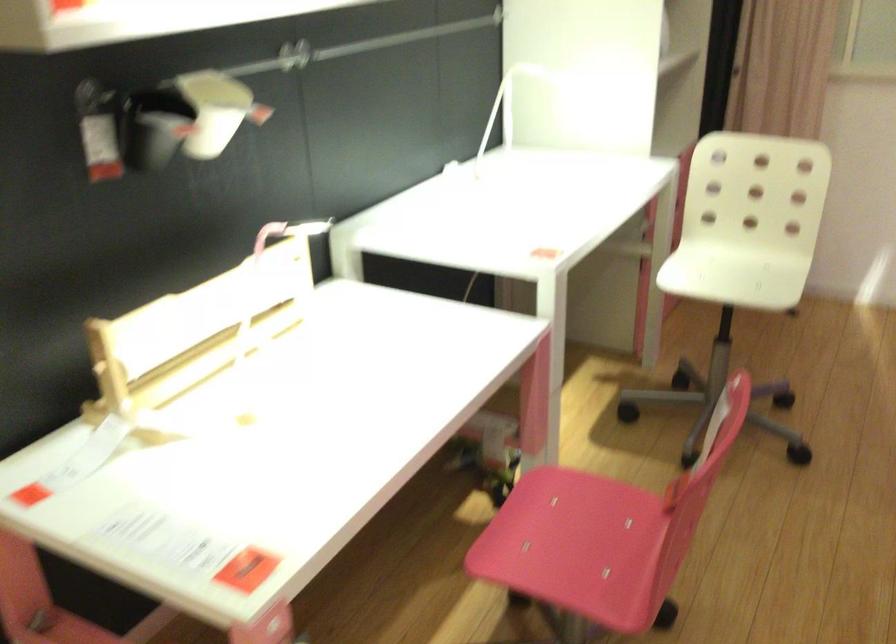
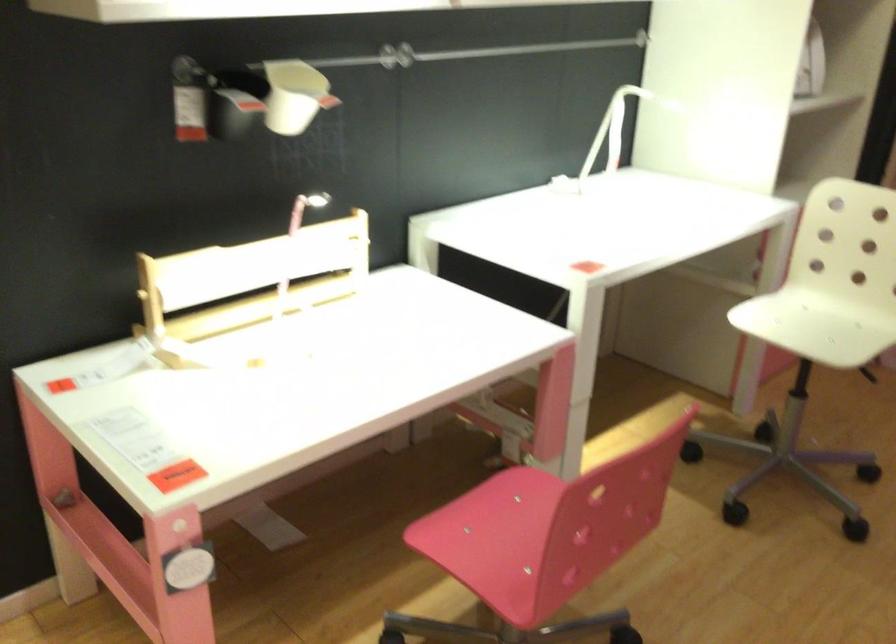
In the second image, find the point that corresponds to point (540, 547) in the first image.

(479, 535)